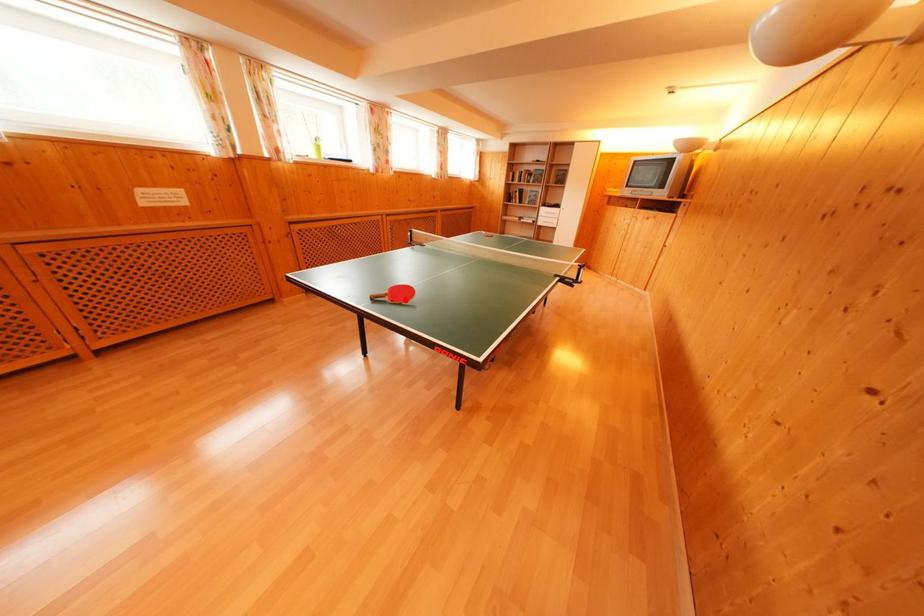
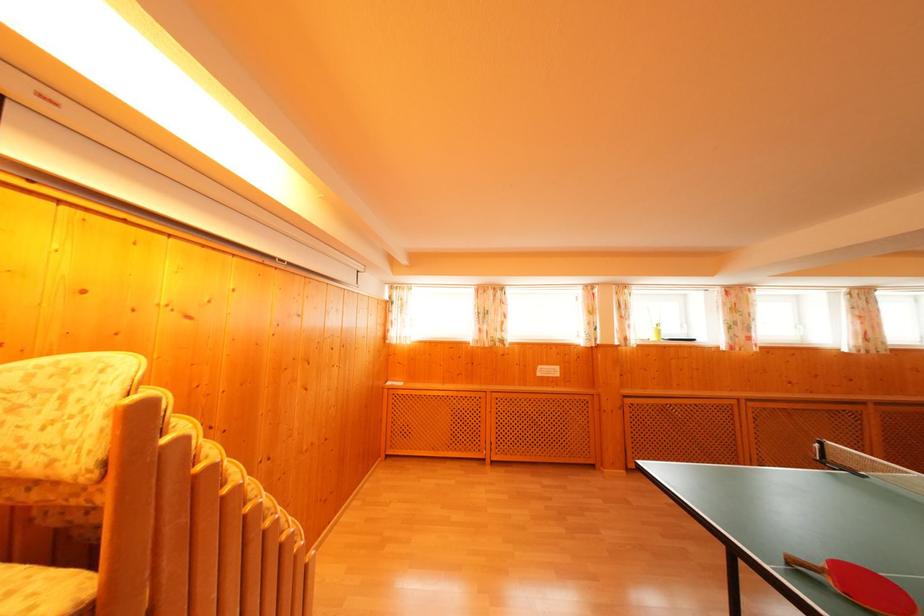
Where in the second image is the point corresponding to the highlighted location from the first image?

(870, 594)